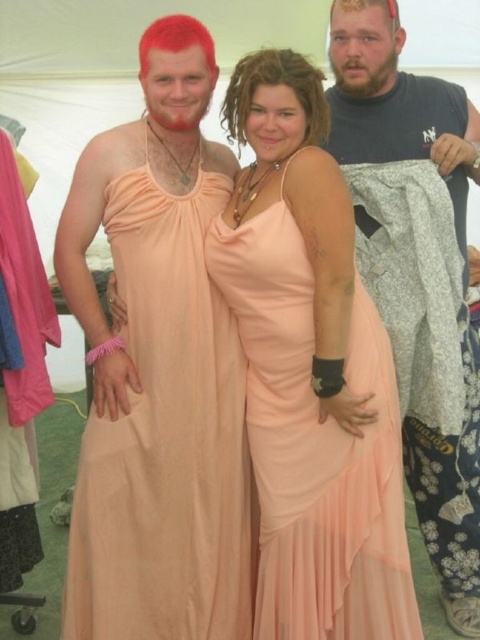
Consider the image. You are a photographer setting up for a group photo. You notice the peach chiffon dress at center and the gray fabric shirt at right. Which clothing item is closer to the camera?

The peach chiffon dress at center is closer to the camera because it is in front of the gray fabric shirt at right.

You are a photographer setting up for a photoshoot and notice two dresses at the center of the image. Which dress is closer to you, the peach satin dress at center or the peach chiffon dress at center?

The peach satin dress at center is closer to you because it is further to the viewer than the peach chiffon dress at center.

You are standing in front of the image and want to determine which of the two points, point (x=222, y=396) or point (x=383, y=113), is nearer to you. Based on the spatial arrangement in the image, which point is closer?

Point (x=222, y=396) is closer to the viewer than point (x=383, y=113).